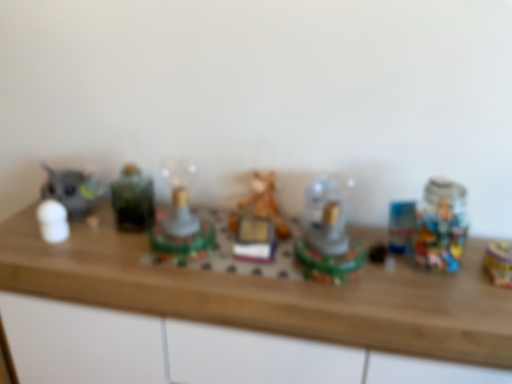
You are a GUI agent. You are given a task and a screenshot of the screen. Output one action in this format:
    pyautogui.click(x=<x>, y=<y>)
    Task: Click on the vacant area that is in front of matte gray cat at left, the second toy in the left-to-right sequence
    Image resolution: width=512 pixels, height=384 pixels.
    Given the screenshot: What is the action you would take?
    pyautogui.click(x=30, y=247)